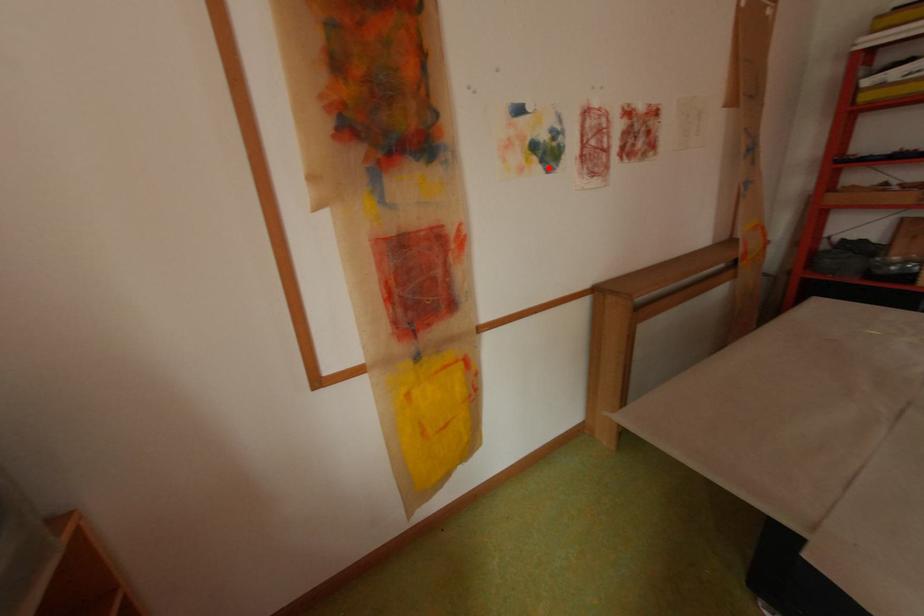
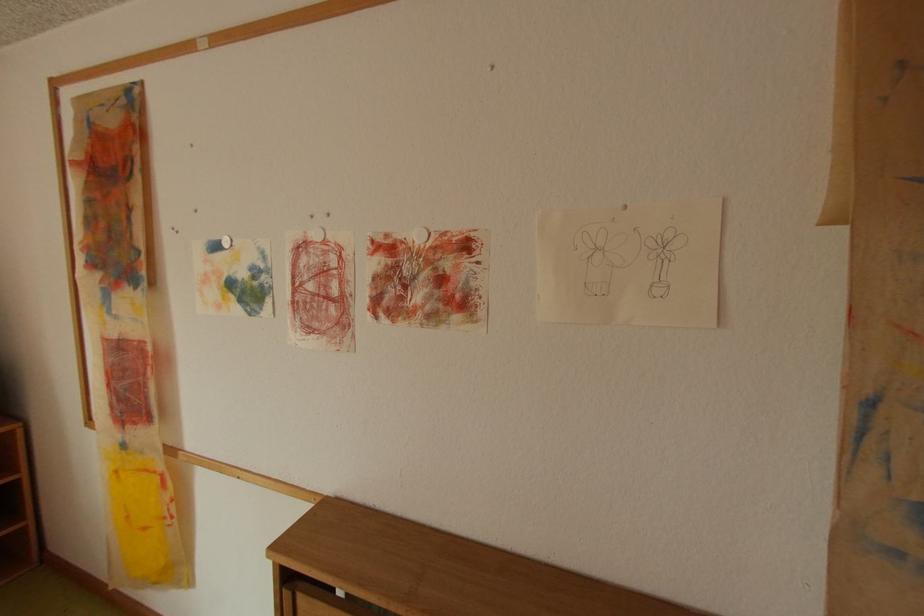
Find the pixel in the second image that matches the highlighted location in the first image.

(247, 309)